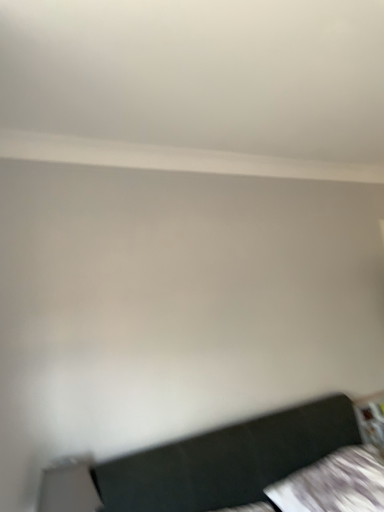
Describe the element at coordinates (334, 484) in the screenshot. The height and width of the screenshot is (512, 384). I see `fluffy white pillow at lower right` at that location.

Where is `fluffy white pillow at lower right`? fluffy white pillow at lower right is located at coordinates (334, 484).

Locate an element on the screen. This screenshot has width=384, height=512. fluffy white pillow at lower right is located at coordinates (334, 484).